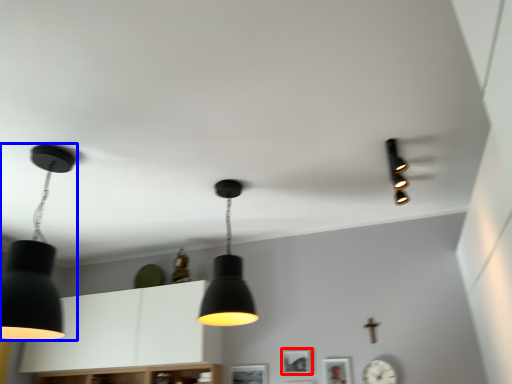
Question: Which of the following is the closest to the observer, picture frame (highlighted by a red box) or lamp (highlighted by a blue box)?

Choices:
 (A) picture frame
 (B) lamp

Answer: (B)